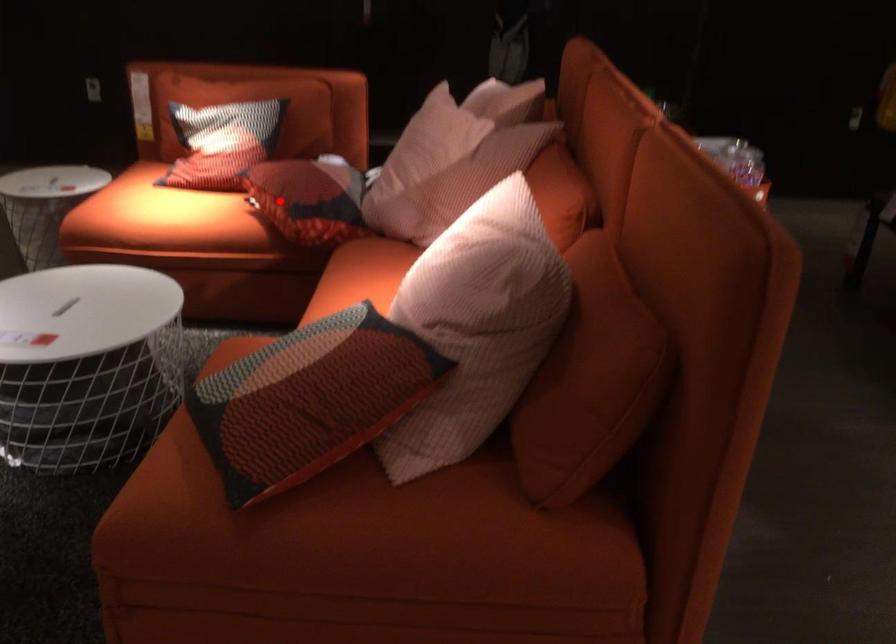
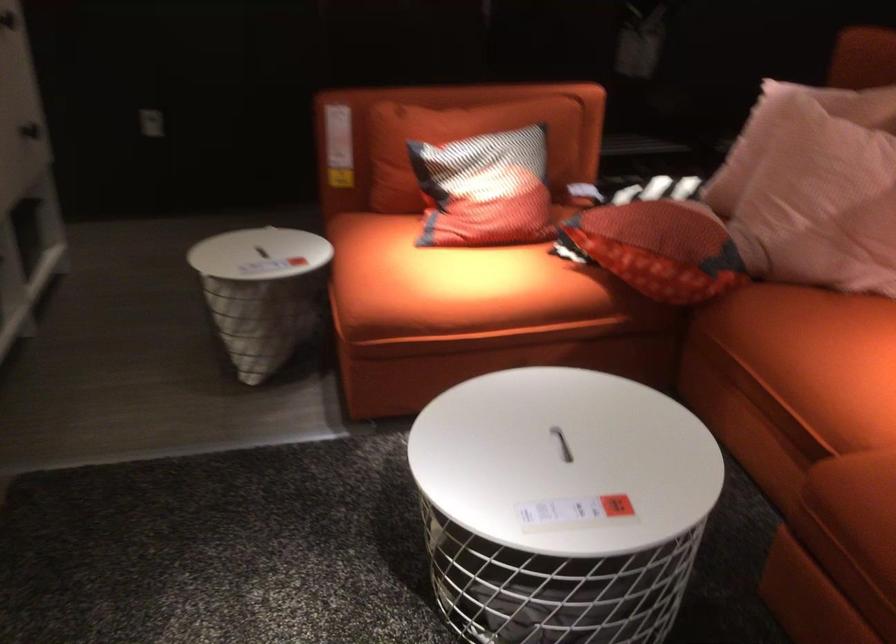
Find the pixel in the second image that matches the highlighted location in the first image.

(659, 248)